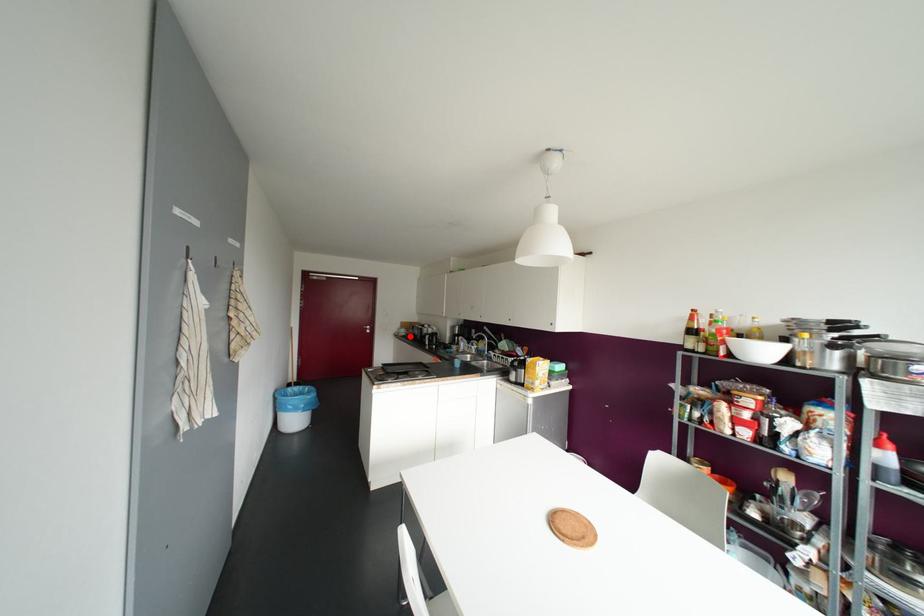
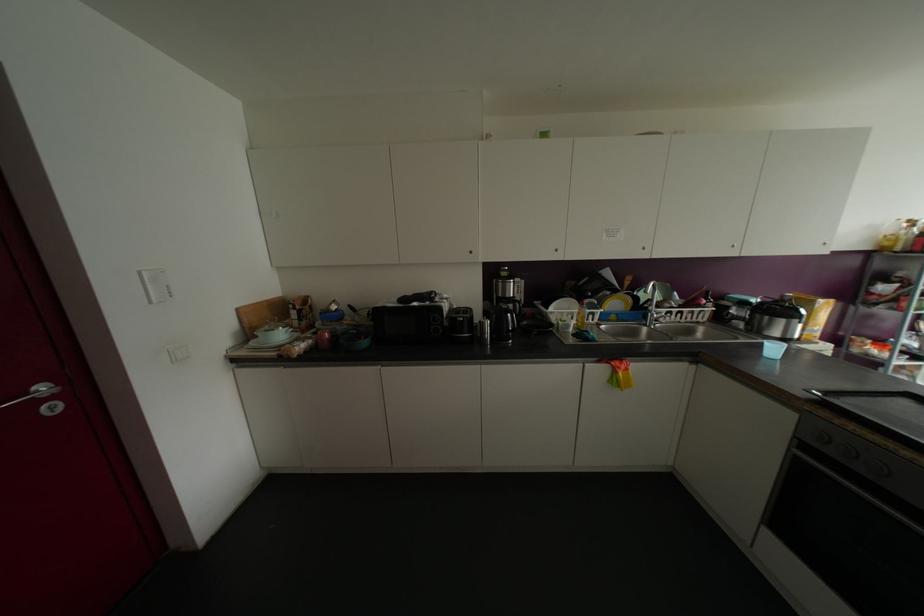
In the second image, find the point that corresponds to the highlighted location in the first image.

(363, 342)